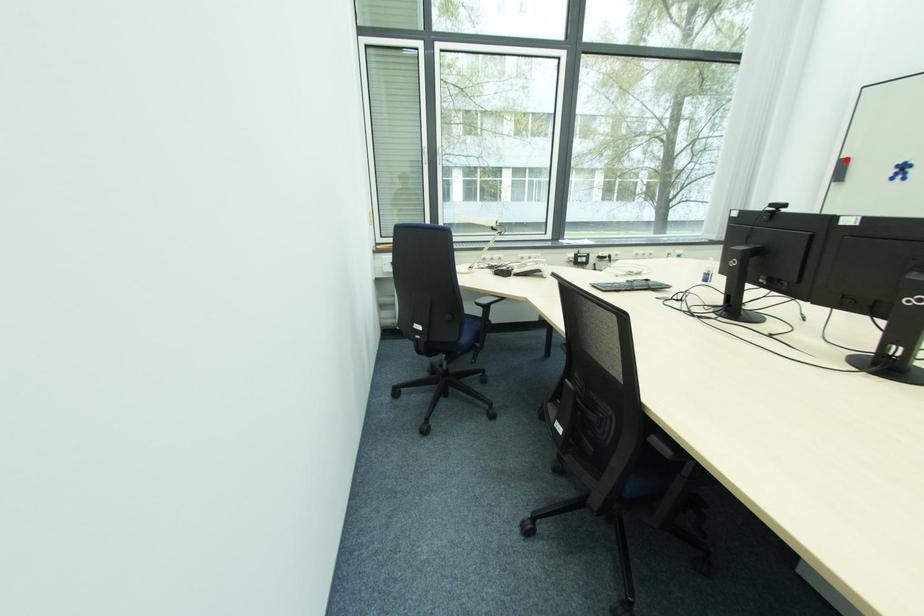
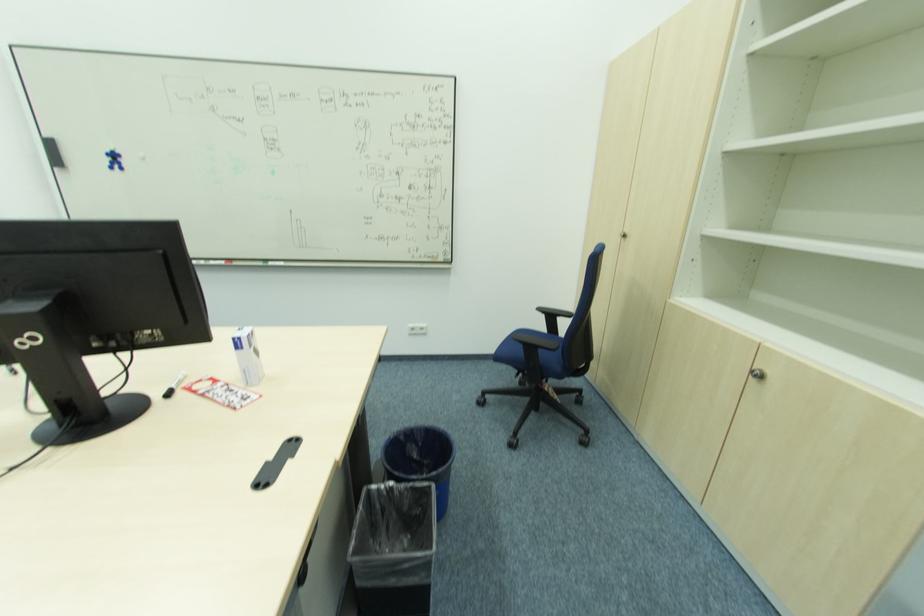
In the second image, find the point that corresponds to the highlighted location in the first image.

(52, 140)